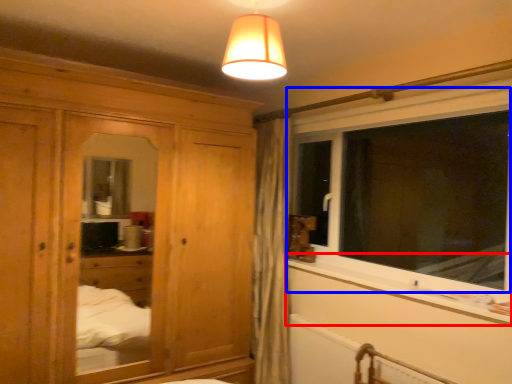
Question: Which of the following is the farthest to the observer, window sill (highlighted by a red box) or window (highlighted by a blue box)?

Choices:
 (A) window sill
 (B) window

Answer: (B)